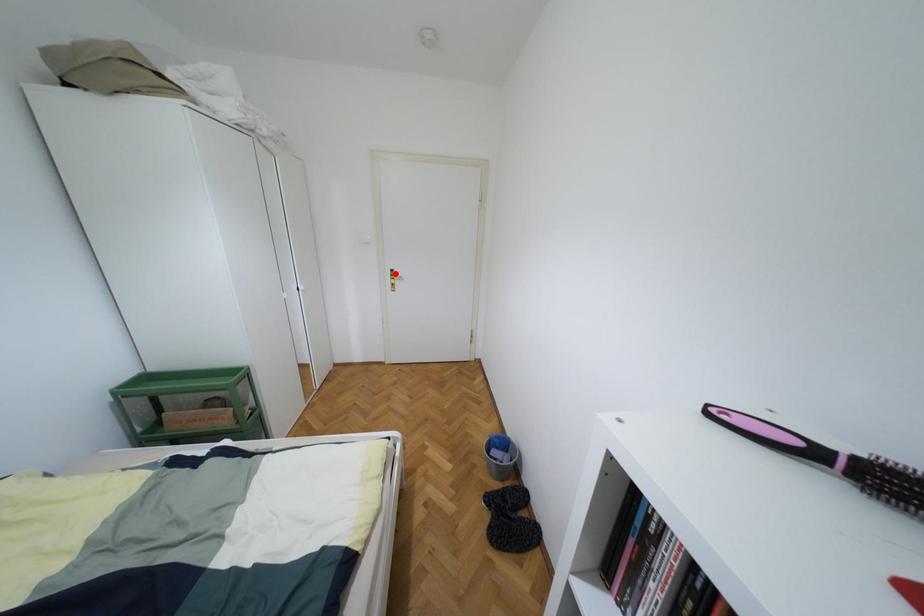
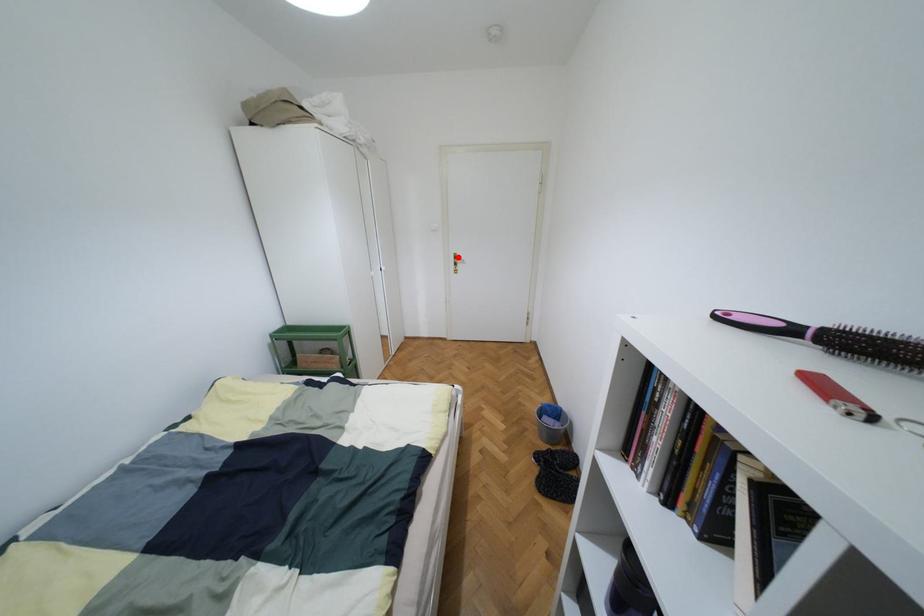
I am providing you with two images of the same scene from different viewpoints. A red point is marked on the first image and another point is marked on the second image. Are the points marked in image1 and image2 representing the same 3D position?

Yes